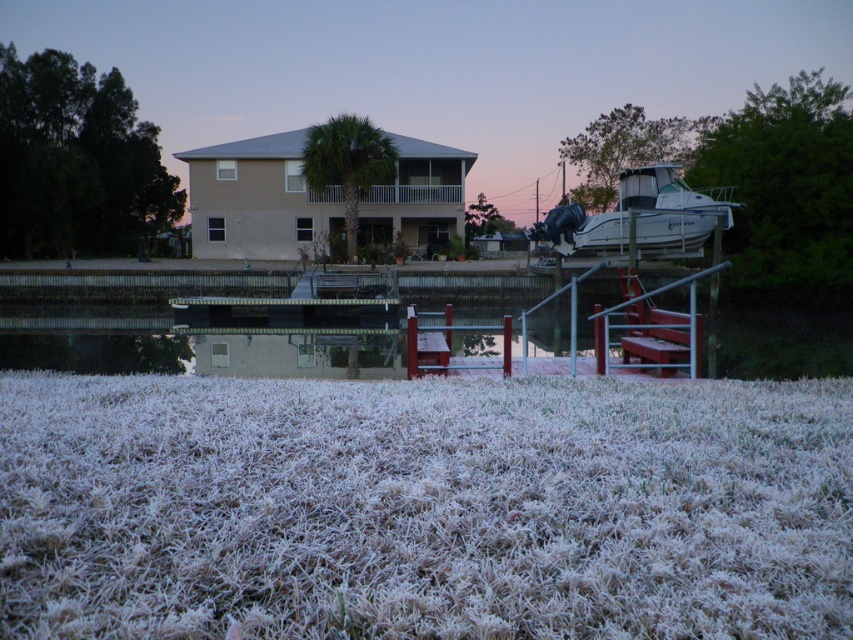
Is frosted grass at lower center shorter than white glossy boat at right?

Yes.

This screenshot has width=853, height=640. In order to click on frosted grass at lower center in this screenshot , I will do `click(422, 508)`.

What do you see at coordinates (422, 508) in the screenshot?
I see `frosted grass at lower center` at bounding box center [422, 508].

Where is `frosted grass at lower center`? Image resolution: width=853 pixels, height=640 pixels. frosted grass at lower center is located at coordinates (422, 508).